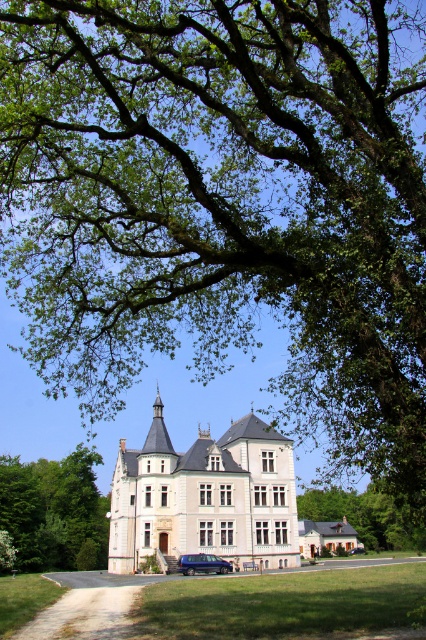
Question: Is orange brick house at center positioned at the back of dark blue metallic van at lower center?

Choices:
 (A) yes
 (B) no

Answer: (A)

Question: Which point is farther from the camera taking this photo?

Choices:
 (A) (198, 493)
 (B) (357, 582)

Answer: (B)

Question: Which point is closer to the camera taking this photo?

Choices:
 (A) (189, 560)
 (B) (344, 541)
 (C) (178, 474)
 (D) (362, 580)

Answer: (A)

Question: Which object is farther from the camera taking this photo?

Choices:
 (A) orange brick house at center
 (B) gray gravel driveway at center
 (C) green leafy tree at center

Answer: (C)

Question: Can you confirm if green leafy tree at center is smaller than orange brick house at center?

Choices:
 (A) yes
 (B) no

Answer: (A)

Question: Can you confirm if orange brick house at center is positioned below dark blue metallic van at lower center?

Choices:
 (A) no
 (B) yes

Answer: (B)